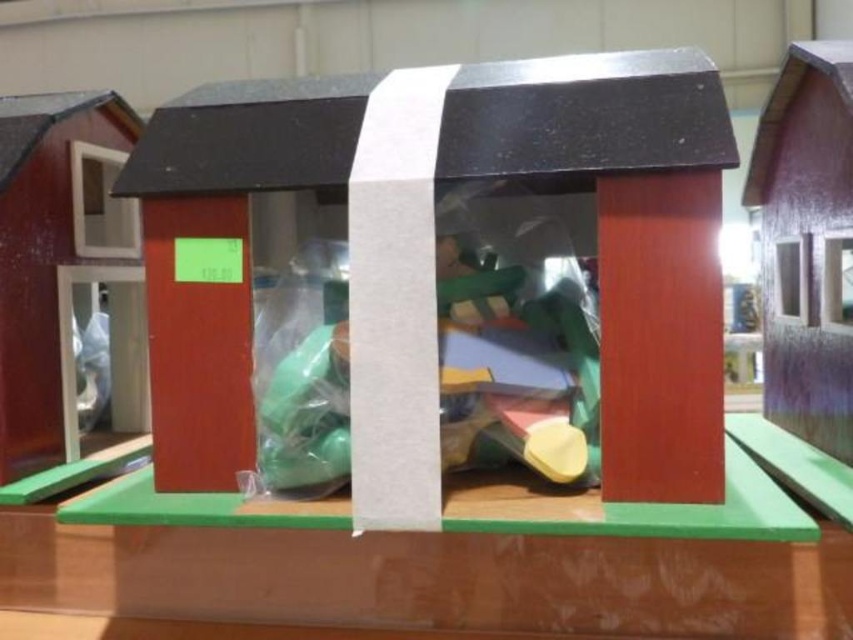
Question: Is matte plastic toys at center positioned before wooden barn door at left?

Choices:
 (A) no
 (B) yes

Answer: (B)

Question: Does matte plastic toys at center have a greater width compared to wooden barn door at left?

Choices:
 (A) no
 (B) yes

Answer: (B)

Question: Among these points, which one is nearest to the camera?

Choices:
 (A) (12, 499)
 (B) (541, 300)

Answer: (A)

Question: Does wooden barn door at left have a greater width compared to purple wood house at right?

Choices:
 (A) yes
 (B) no

Answer: (A)

Question: Which of these objects is positioned closest to the purple wood house at right?

Choices:
 (A) wooden barn door at left
 (B) matte plastic toys at center

Answer: (B)

Question: Which of these objects is positioned closest to the matte plastic toys at center?

Choices:
 (A) wooden barn door at left
 (B) purple wood house at right

Answer: (B)